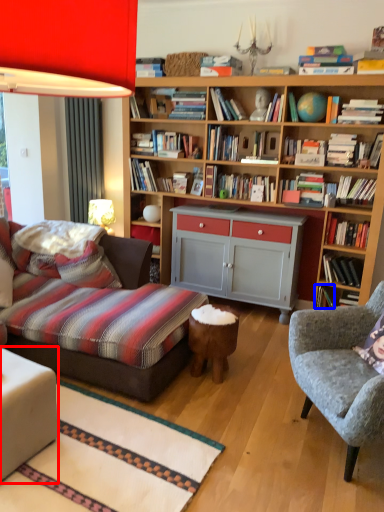
Question: Which of the following is the closest to the observer, table (highlighted by a red box) or book (highlighted by a blue box)?

Choices:
 (A) table
 (B) book

Answer: (A)